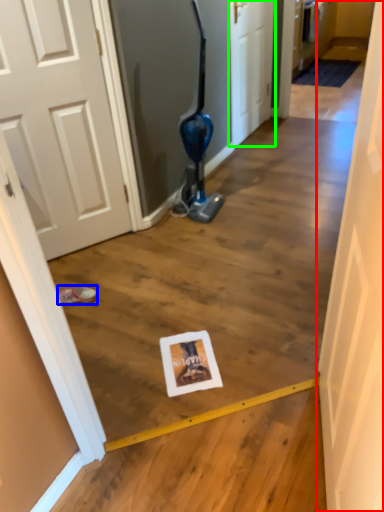
Question: Which object is the closest to the door (highlighted by a red box)? Choose among these: footwear (highlighted by a blue box) or door (highlighted by a green box).

Choices:
 (A) footwear
 (B) door

Answer: (A)